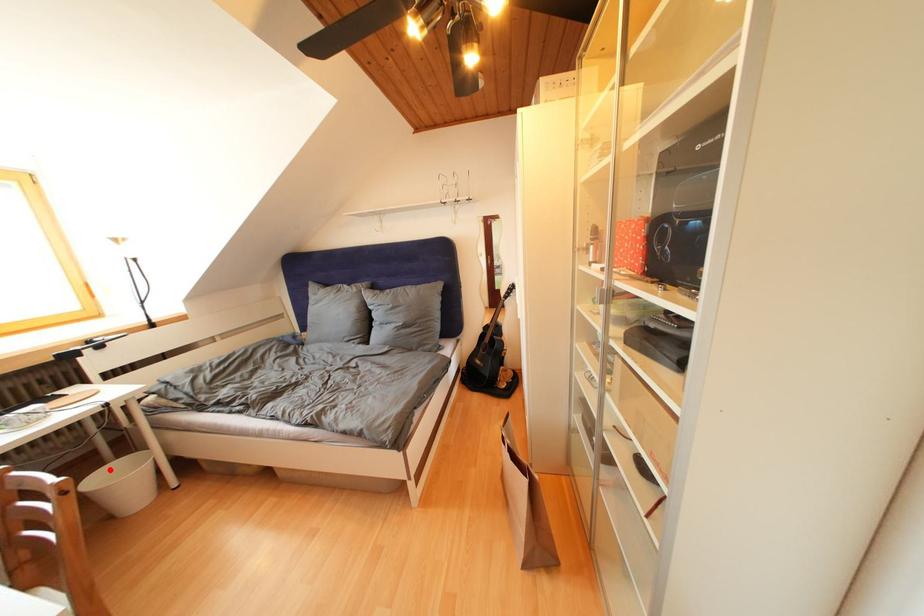
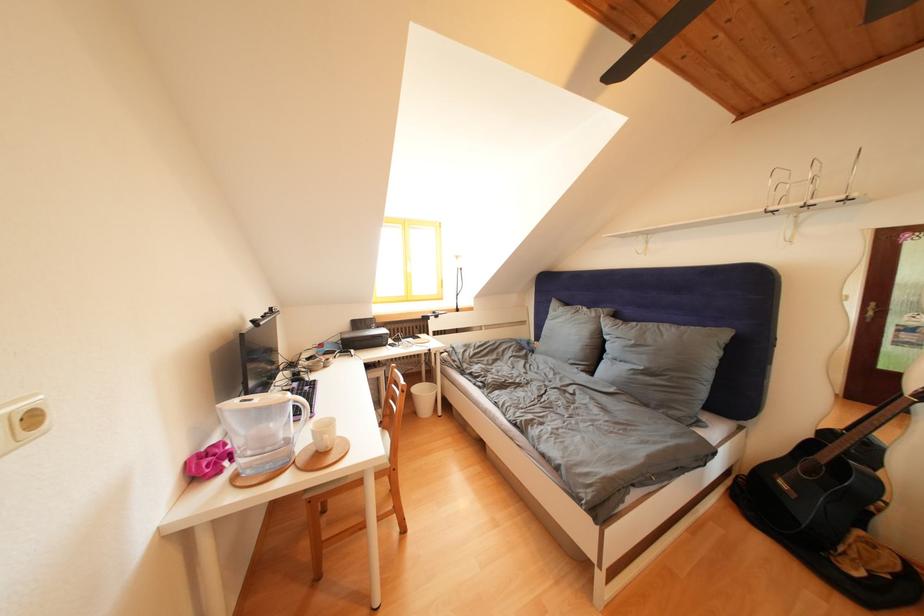
In the second image, find the point that corresponds to the highlighted location in the first image.

(429, 387)